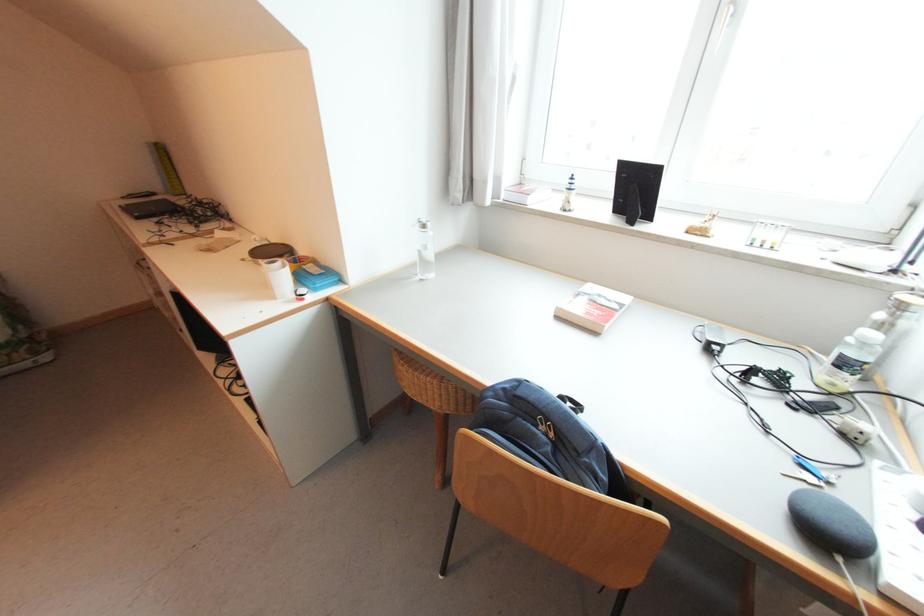
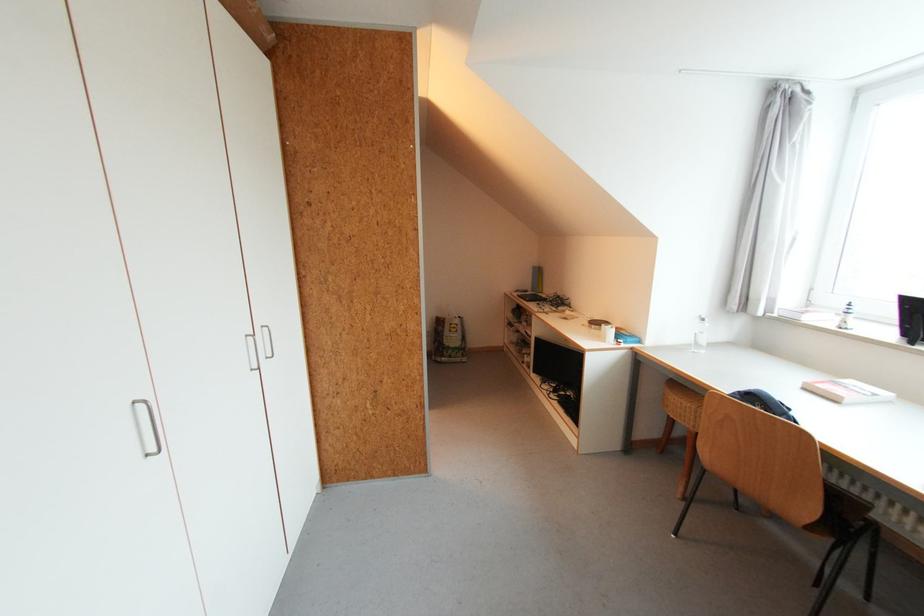
Where in the second image is the point corresponding to point 570,211 from the first image?

(845, 329)